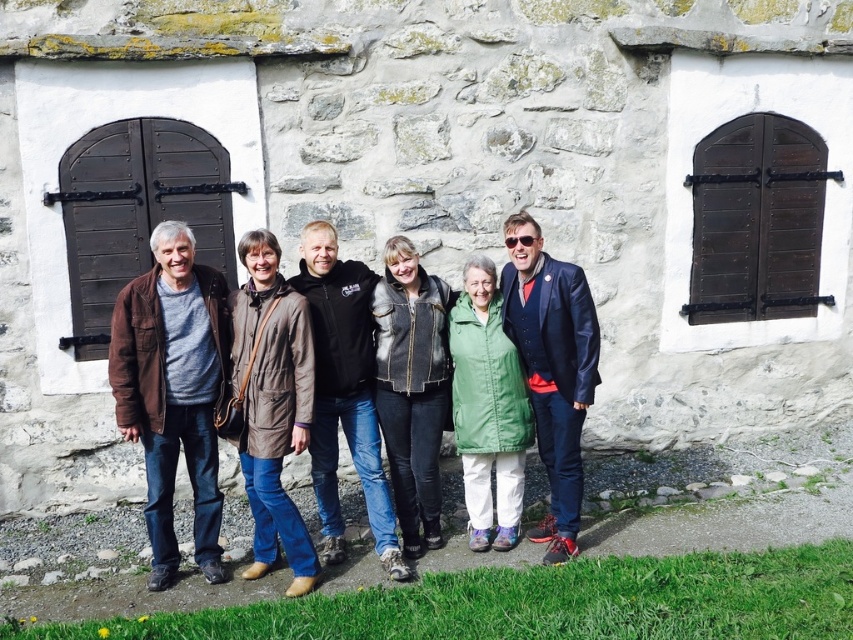
You are a photographer trying to arrange the group so that the brown leather jacket at center and the brown leather jacket at left are visible. Which jacket should you position closer to the camera to ensure both are fully visible?

The brown leather jacket at left should be positioned closer to the camera because if the brown leather jacket at center is wider, placing the narrower one closer ensures both are fully visible without overlap.

You are a photographer trying to arrange two people wearing brown leather jackets for a photo. The jackets are labeled as brown leather jacket at center and brown leather jacket at left. Based on the scene, which jacket is positioned higher up compared to the other?

The brown leather jacket at center is taller than the brown leather jacket at left, so the one at center is positioned higher up.

You are a photographer trying to capture a clear shot of both the brown leather jacket at center and the brown leather jacket at left. Since they are positioned close to each other, will you be able to adjust your angle to ensure both are fully visible without one blocking the other?

The brown leather jacket at center is in front of the brown leather jacket at left, so adjusting the angle might allow you to see both, but the one at center may still partially obscure the left one depending on the adjustment.